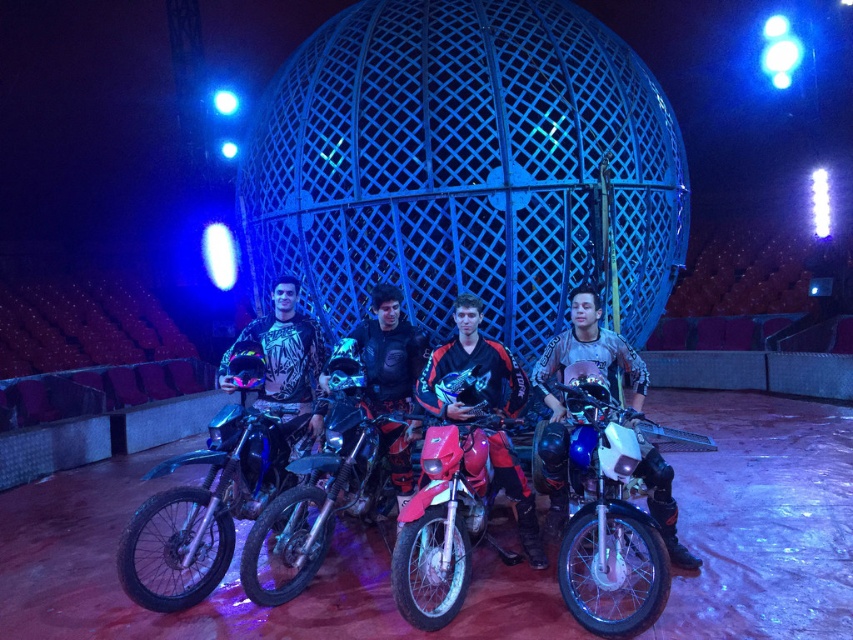
Question: Among these points, which one is nearest to the camera?

Choices:
 (A) (418, 358)
 (B) (326, 502)

Answer: (B)

Question: Does brushed metal motorcycle at center have a larger size compared to blue metallic motorcycle at center?

Choices:
 (A) no
 (B) yes

Answer: (B)

Question: Does red matte motorcycle at center appear over black matte jacket at center?

Choices:
 (A) yes
 (B) no

Answer: (B)

Question: Which of these objects is positioned farthest from the black matte jacket at center?

Choices:
 (A) brushed metal motorcycle at center
 (B) red matte dirt bike at center

Answer: (A)

Question: Which of the following is the farthest from the observer?

Choices:
 (A) (339, 349)
 (B) (572, 515)
 (C) (397, 486)
 (D) (447, 419)

Answer: (C)

Question: Does red matte dirt bike at center have a greater width compared to red matte motorcycle at center?

Choices:
 (A) yes
 (B) no

Answer: (B)